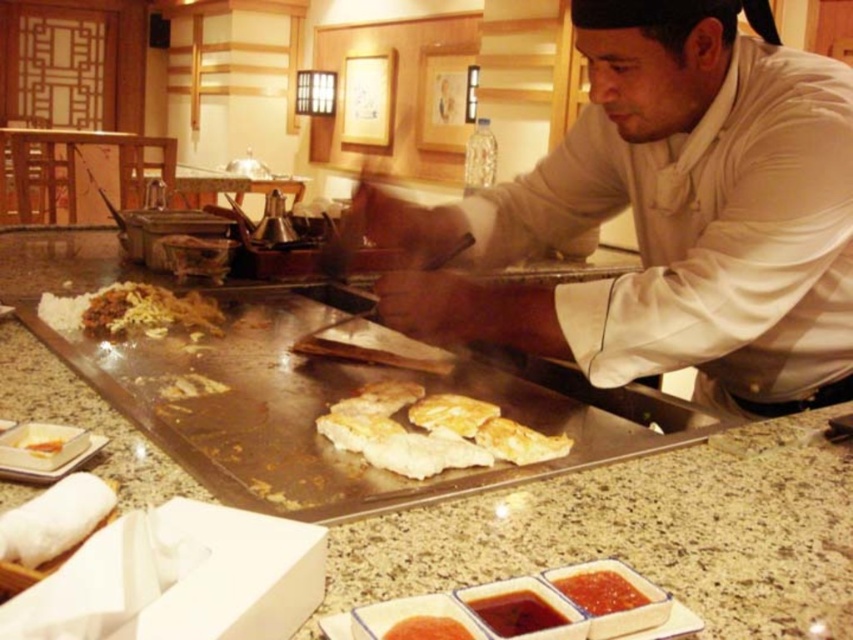
Is point (569, 595) positioned after point (550, 440)?

No.

Which is behind, point (596, 570) or point (497, 424)?

Positioned behind is point (497, 424).

Who is more distant from viewer, (608, 572) or (532, 445)?

Positioned behind is point (532, 445).

I want to click on smooth tomato sauce at lower center, so click(x=601, y=592).

Is golden crispy chicken at center to the right of white rice with brown sauce at center-left from the viewer's perspective?

Indeed, golden crispy chicken at center is positioned on the right side of white rice with brown sauce at center-left.

Does golden crispy chicken at center have a lesser height compared to white rice with brown sauce at center-left?

Yes, golden crispy chicken at center is shorter than white rice with brown sauce at center-left.

Image resolution: width=853 pixels, height=640 pixels. Describe the element at coordinates (431, 432) in the screenshot. I see `golden crispy chicken at center` at that location.

At what (x,y) coordinates should I click in order to perform the action: click on golden crispy chicken at center. Please return your answer as a coordinate pair (x, y). This screenshot has width=853, height=640. Looking at the image, I should click on (431, 432).

Is white glossy chicken at center closer to the viewer compared to smooth orange sauce at center?

No, it is behind smooth orange sauce at center.

Image resolution: width=853 pixels, height=640 pixels. Identify the location of white glossy chicken at center. (519, 442).

This screenshot has width=853, height=640. In order to click on white glossy chicken at center in this screenshot , I will do tap(519, 442).